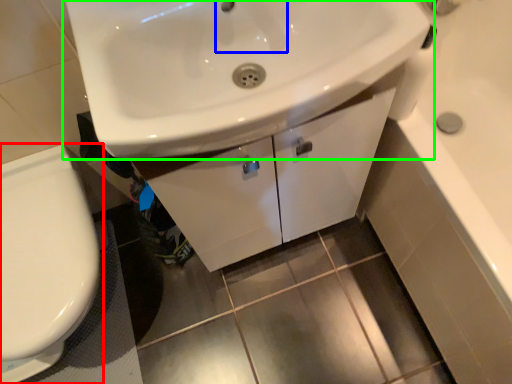
Question: Which is farther away from toilet (highlighted by a red box)? faucet (highlighted by a blue box) or sink (highlighted by a green box)?

Choices:
 (A) faucet
 (B) sink

Answer: (A)